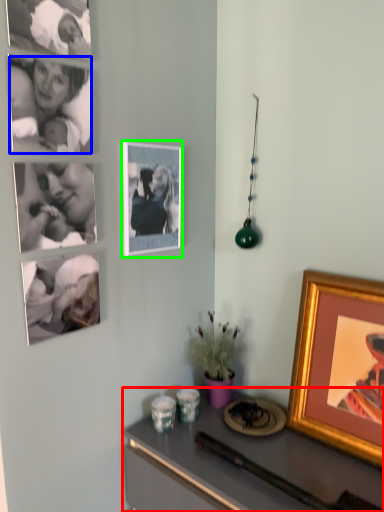
Question: Which object is the closest to the desk (highlighted by a red box)? Choose among these: person (highlighted by a blue box) or picture frame (highlighted by a green box).

Choices:
 (A) person
 (B) picture frame

Answer: (B)